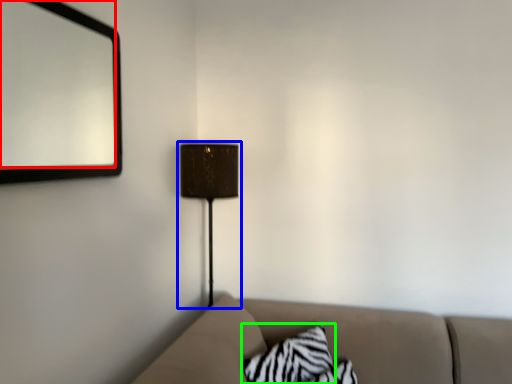
Question: Considering the real-world distances, which object is farthest from mirror (highlighted by a red box)? lamp (highlighted by a blue box) or pillow (highlighted by a green box)?

Choices:
 (A) lamp
 (B) pillow

Answer: (B)